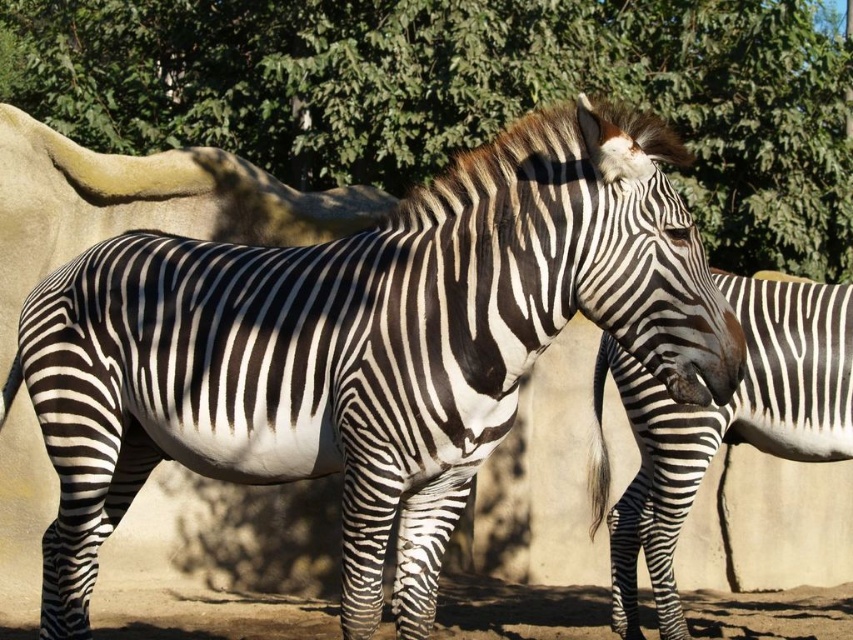
You are a zookeeper trying to determine the best spot to place a new feeding station between the two points, point (664, 556) and point (467, 624). Which point is closer to the zebras so the feeding station can be easily accessible?

Point (664, 556) is closer to the viewer than point (467, 624), so placing the feeding station at point (664, 556) would be closer to the zebras.

You are a bird looking for a place to perch. You see the green leafy tree at upper center and the brown soil at lower center. Which location would allow you to perch higher?

The green leafy tree at upper center is much taller than the brown soil at lower center, so you can perch higher there.

You are a bird looking for a place to perch. You see a green leafy tree at upper center and brown soil at lower center. Which location would allow you to perch comfortably?

The green leafy tree at upper center is smaller than the brown soil at lower center, so the brown soil at lower center would provide a more stable and spacious area for perching.